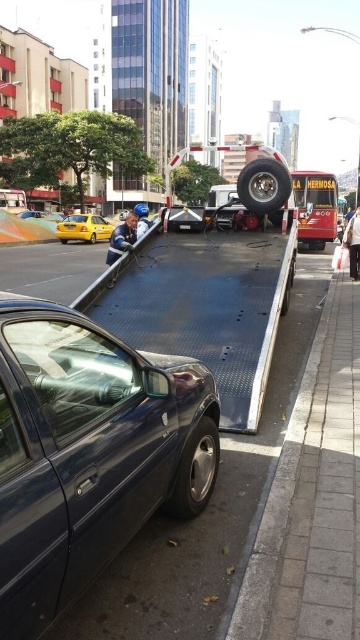
You are a delivery person who needs to park your van between the matte dark blue sedan at center and the yellow matte taxi at left. Can you fit your van which is 2 meters wide in the space between them?

The matte dark blue sedan at center is narrower than the yellow matte taxi at left, but the exact width difference isn t provided. However, since the sedan s width is less than the taxi s, the space between them might be sufficient for a 2 meter wide van. However, without knowing the actual distance between the vehicles, it s impossible to confirm.

You are a pedestrian trying to cross the street where the matte dark blue sedan at center and the yellow matte taxi at left are parked. Which vehicle should you avoid stepping near if you want to stay on the right side of the road?

You should avoid stepping near the yellow matte taxi at left because the matte dark blue sedan at center is to the right of it, so staying on the right side would mean keeping the sedan on your left and the taxi further left.

You are a delivery person standing next to the flatbed tow truck parked on the side of the road. You need to place a package that is 5 feet long on the ground between the flatbed tow truck and the matte dark blue sedan at center. Is there enough space to place the package without it overlapping either vehicle?

The distance between the flatbed tow truck and the matte dark blue sedan at center is 4.33 feet, which is less than the 5 feet length of the package. Therefore, there is not enough space to place the package without overlapping either vehicle.